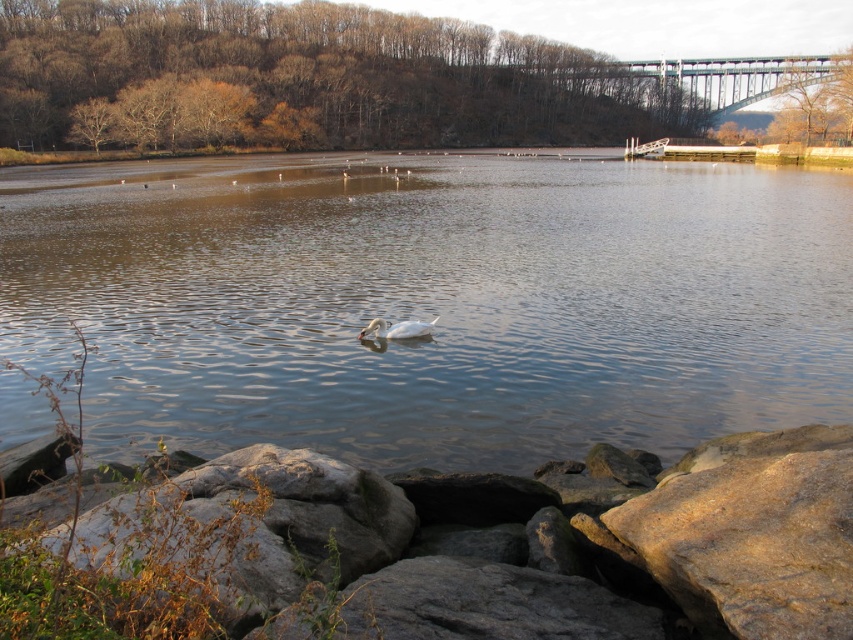
Can you confirm if clear water at center is thinner than white glossy duck at center?

Incorrect, clear water at center's width is not less than white glossy duck at center's.

Find the location of a particular element. The width and height of the screenshot is (853, 640). clear water at center is located at coordinates (432, 301).

Who is more distant from viewer, (770, 396) or (383, 324)?

The point (383, 324) is behind.

Identify the location of clear water at center. (432, 301).

Is brown rough rock at lower center wider than metallic gray bridge at upper center?

In fact, brown rough rock at lower center might be narrower than metallic gray bridge at upper center.

I want to click on brown rough rock at lower center, so click(477, 554).

Between brown rough rock at lower center and white glossy duck at center, which one appears on the right side from the viewer's perspective?

Positioned to the right is brown rough rock at lower center.

Between point (535, 513) and point (401, 324), which one is positioned behind?

The point (401, 324) is more distant.

Between point (492, 563) and point (367, 330), which one is positioned in front?

Point (492, 563) is in front.

Locate an element on the screen. brown rough rock at lower center is located at coordinates (477, 554).